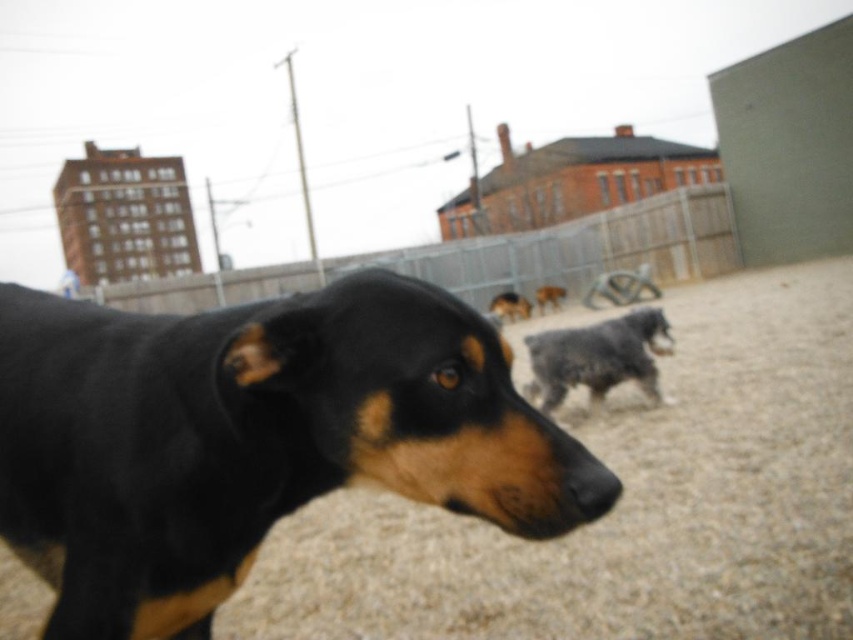
Question: In this image, where is black fur dog at center located relative to fuzzy gray dog at center?

Choices:
 (A) above
 (B) below

Answer: (A)

Question: Based on their relative distances, which object is farther from the brown fur dog at center?

Choices:
 (A) brown gravel at center
 (B) gray woolen sweater at center
 (C) gray metal fence at upper center
 (D) black fur dog at center

Answer: (D)

Question: Among these objects, which one is nearest to the camera?

Choices:
 (A) gray metal fence at upper center
 (B) black fur dog at center
 (C) brown fur dog at center

Answer: (B)

Question: Can you confirm if brown gravel at center is positioned to the right of gray metal fence at upper center?

Choices:
 (A) no
 (B) yes

Answer: (B)

Question: Does black fur dog at center appear on the right side of brown gravel at center?

Choices:
 (A) yes
 (B) no

Answer: (B)

Question: Considering the real-world distances, which object is farthest from the gray metal fence at upper center?

Choices:
 (A) fuzzy gray dog at center
 (B) brown gravel at center

Answer: (A)